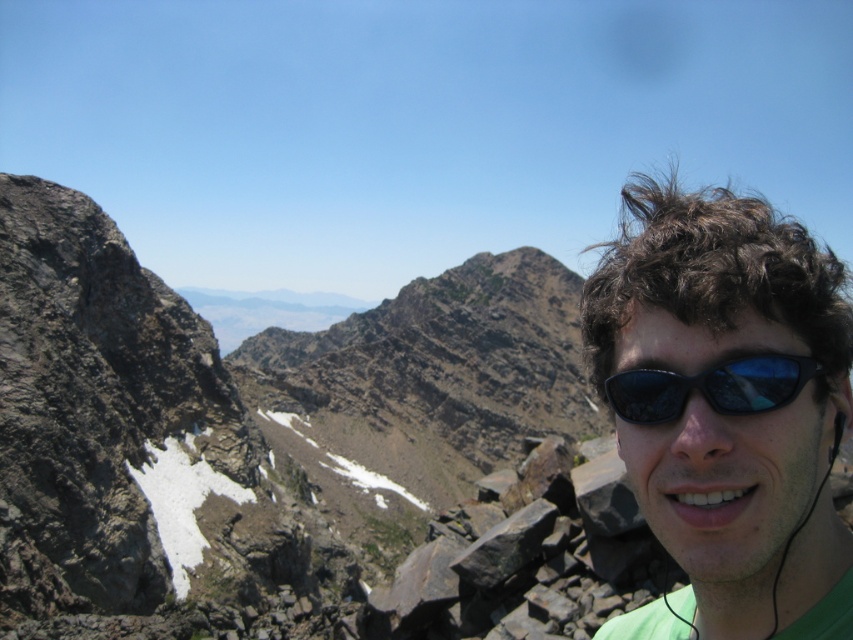
Can you confirm if brown rocky mountain at upper left is bigger than green matte sunglasses at upper right?

Indeed, brown rocky mountain at upper left has a larger size compared to green matte sunglasses at upper right.

From the picture: Between brown rocky mountain at upper left and green matte sunglasses at upper right, which one is positioned higher?

Positioned higher is green matte sunglasses at upper right.

Is point (380, 353) more distant than point (666, 209)?

Yes, it is.

Where is `brown rocky mountain at upper left`? This screenshot has width=853, height=640. brown rocky mountain at upper left is located at coordinates (233, 396).

Who is more distant from viewer, (x=628, y=408) or (x=715, y=392)?

Result: Positioned behind is point (x=628, y=408).

This screenshot has width=853, height=640. What do you see at coordinates (729, 403) in the screenshot?
I see `green matte sunglasses at upper right` at bounding box center [729, 403].

Is point (805, 234) closer to camera compared to point (700, 374)?

That is False.

You are a GUI agent. You are given a task and a screenshot of the screen. Output one action in this format:
    pyautogui.click(x=<x>, y=<y>)
    Task: Click on the green matte sunglasses at upper right
    The image size is (853, 640).
    Given the screenshot: What is the action you would take?
    pyautogui.click(x=729, y=403)

What do you see at coordinates (233, 396) in the screenshot?
I see `brown rocky mountain at upper left` at bounding box center [233, 396].

Between brown rocky mountain at upper left and black reflective sunglasses at right, which one appears on the left side from the viewer's perspective?

brown rocky mountain at upper left

Which is behind, point (560, 340) or point (787, 371)?

Positioned behind is point (560, 340).

Locate an element on the screen. This screenshot has width=853, height=640. brown rocky mountain at upper left is located at coordinates (233, 396).